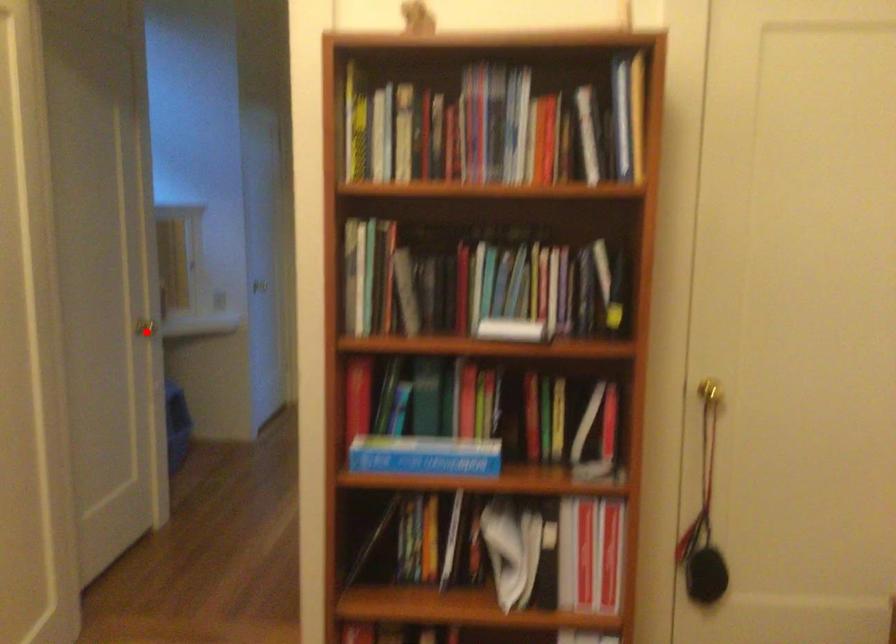
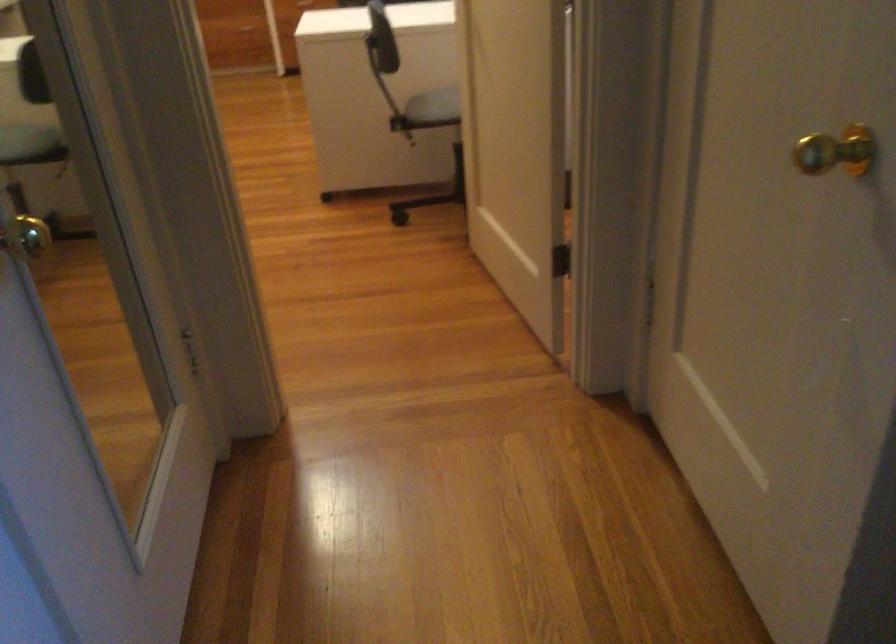
Where in the second image is the point corresponding to the highlighted location from the first image?

(836, 152)